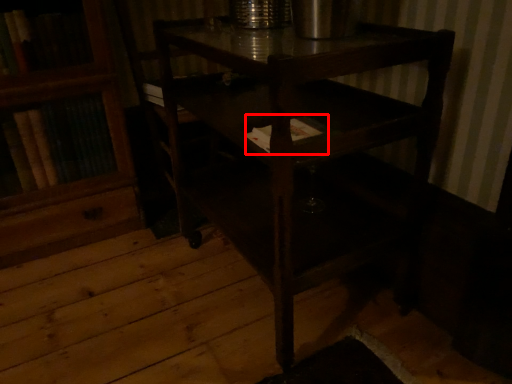
Question: From the image's perspective, what is the correct spatial positioning of book (annotated by the red box) in reference to table?

Choices:
 (A) below
 (B) above

Answer: (B)